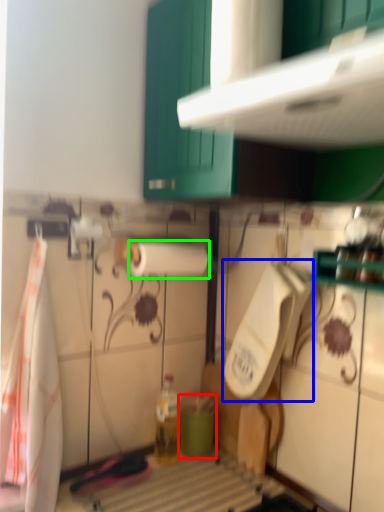
Question: Which object is the farthest from teal (highlighted by a red box)? Choose among these: urinal (highlighted by a blue box) or paper towel (highlighted by a green box).

Choices:
 (A) urinal
 (B) paper towel

Answer: (B)